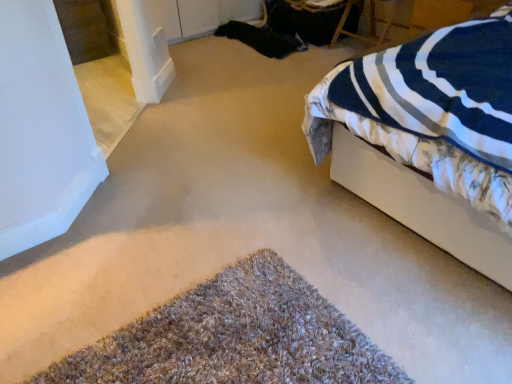
Question: Is white fabric bed at right positioned in front of wooden chair at upper right?

Choices:
 (A) no
 (B) yes

Answer: (B)

Question: Is white fabric bed at right not inside wooden chair at upper right?

Choices:
 (A) yes
 (B) no

Answer: (A)

Question: Is wooden chair at upper right completely or partially inside white fabric bed at right?

Choices:
 (A) no
 (B) yes

Answer: (A)

Question: From a real-world perspective, is white fabric bed at right beneath wooden chair at upper right?

Choices:
 (A) yes
 (B) no

Answer: (B)

Question: Does white fabric bed at right have a lesser height compared to wooden chair at upper right?

Choices:
 (A) yes
 (B) no

Answer: (B)

Question: From the image's perspective, is white fabric bed at right positioned above or below wooden chair at upper right?

Choices:
 (A) above
 (B) below

Answer: (B)

Question: Does point (432, 44) appear closer or farther from the camera than point (379, 39)?

Choices:
 (A) farther
 (B) closer

Answer: (B)

Question: Is white fabric bed at right bigger or smaller than wooden chair at upper right?

Choices:
 (A) small
 (B) big

Answer: (B)

Question: Relative to wooden chair at upper right, is white fabric bed at right in front or behind?

Choices:
 (A) front
 (B) behind

Answer: (A)

Question: Would you say brown shaggy carpet at lower center is to the left or to the right of white fabric bed at right in the picture?

Choices:
 (A) right
 (B) left

Answer: (B)

Question: From the image's perspective, is brown shaggy carpet at lower center located above or below white fabric bed at right?

Choices:
 (A) below
 (B) above

Answer: (A)

Question: Looking at the image, does brown shaggy carpet at lower center seem bigger or smaller compared to white fabric bed at right?

Choices:
 (A) small
 (B) big

Answer: (A)

Question: Is brown shaggy carpet at lower center inside or outside of white fabric bed at right?

Choices:
 (A) inside
 (B) outside

Answer: (B)

Question: In the image, is wooden chair at upper right on the left side or the right side of brown shaggy carpet at lower center?

Choices:
 (A) left
 (B) right

Answer: (B)

Question: Is wooden chair at upper right in front of or behind brown shaggy carpet at lower center in the image?

Choices:
 (A) front
 (B) behind

Answer: (B)